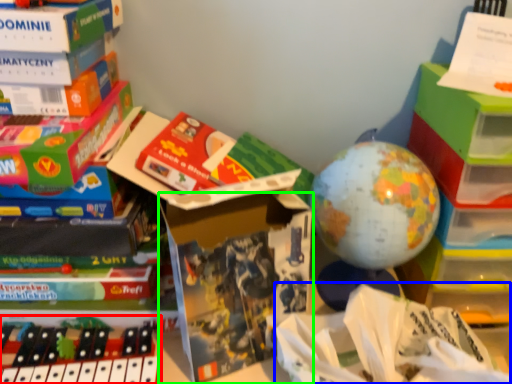
Question: Estimate the real-world distances between objects in this image. Which object is farther from toy (highlighted by a red box), wrapping paper (highlighted by a blue box) or paperback book (highlighted by a green box)?

Choices:
 (A) wrapping paper
 (B) paperback book

Answer: (A)